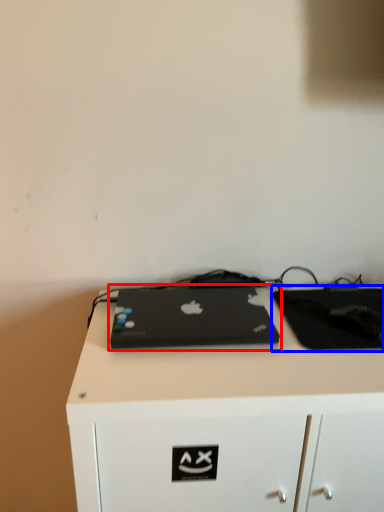
Question: Which object appears farthest to the camera in this image, laptop (highlighted by a red box) or tablet computer (highlighted by a blue box)?

Choices:
 (A) laptop
 (B) tablet computer

Answer: (B)